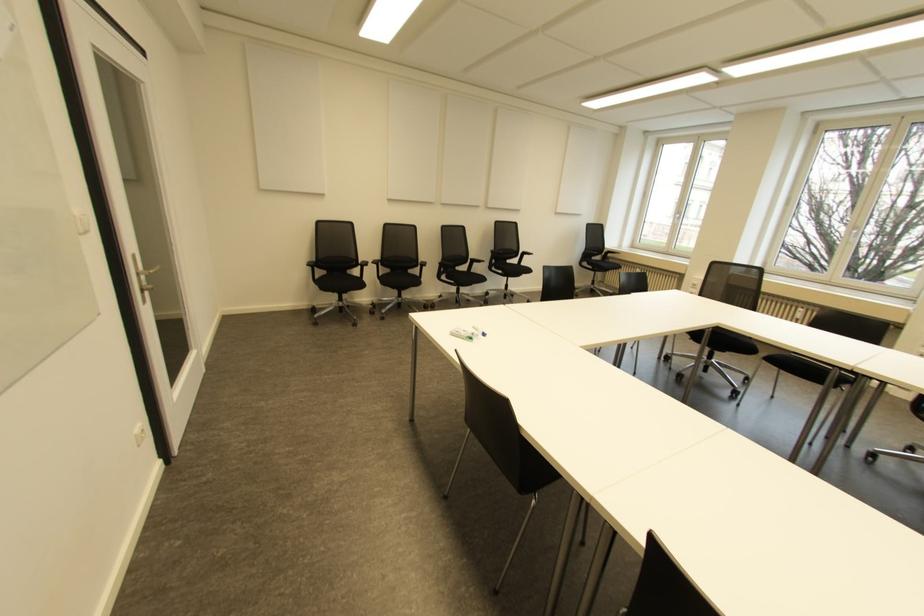
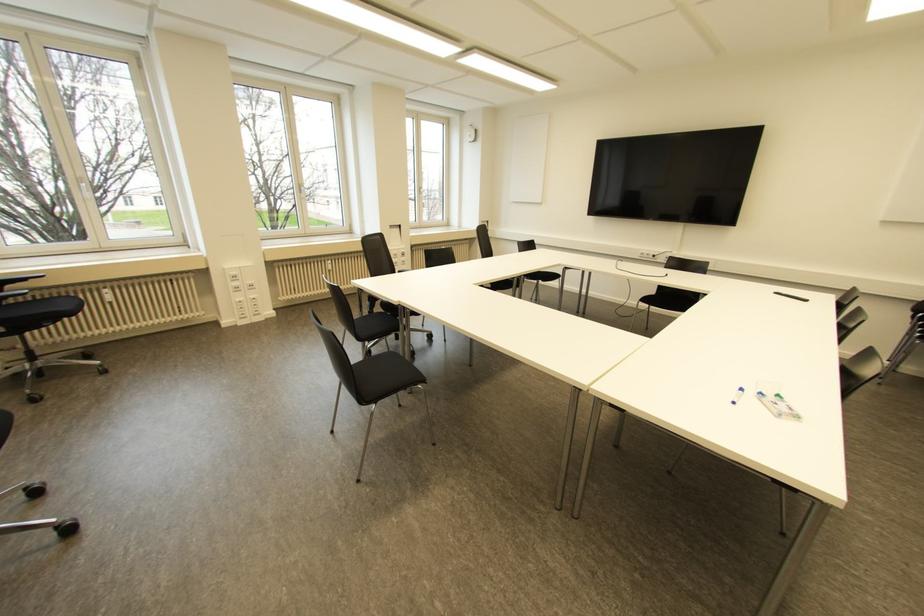
Find the pixel in the second image that matches the point at 470,338 in the first image.

(777, 395)